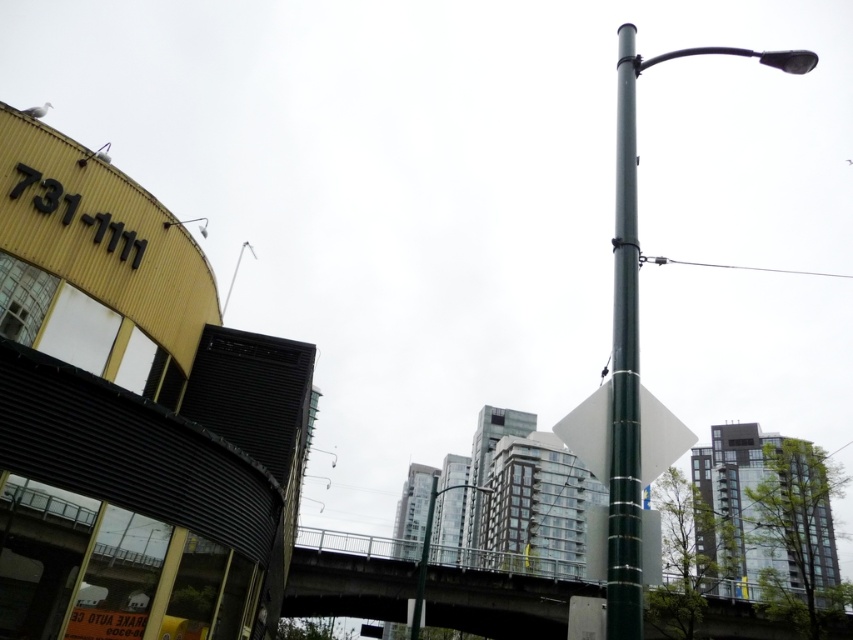
Question: Can you confirm if green metallic pole at upper right is positioned to the left of green metallic pole at center?

Choices:
 (A) yes
 (B) no

Answer: (A)

Question: Is concrete bridge at center bigger than green metallic pole at upper right?

Choices:
 (A) yes
 (B) no

Answer: (B)

Question: Which object is positioned closest to the metallic pole at center?

Choices:
 (A) concrete bridge at center
 (B) metallic street light at upper center
 (C) green metallic pole at upper right

Answer: (A)

Question: Which of the following is the closest to the observer?

Choices:
 (A) concrete bridge at center
 (B) metallic street light at upper center

Answer: (B)

Question: Among these points, which one is nearest to the camera?

Choices:
 (A) (172, 225)
 (B) (613, 632)
 (C) (616, 547)

Answer: (B)

Question: Can you confirm if green metallic pole at upper right is wider than metallic pole at center?

Choices:
 (A) no
 (B) yes

Answer: (B)